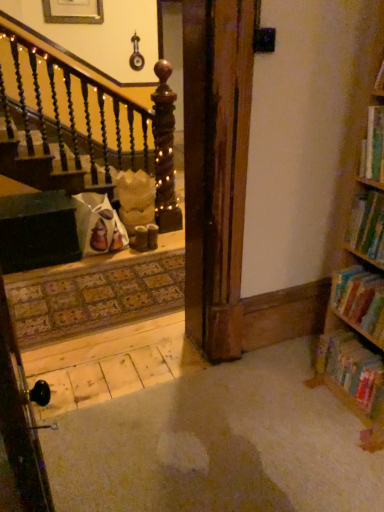
Where is `vacant area situated below green matte bookshelf at right, which is the third book from bottom to top (from a real-world perspective)`? This screenshot has height=512, width=384. vacant area situated below green matte bookshelf at right, which is the third book from bottom to top (from a real-world perspective) is located at coordinates (369, 271).